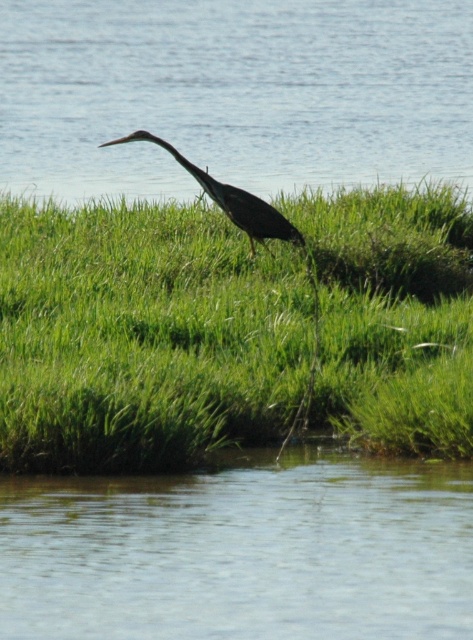
You are a photographer trying to capture the dark gray matte bird at center in your shot. You want to ensure the green grassy at center is visible but not blocking the bird. Based on the scene, can you position yourself so that the bird remains visible without the grass obscuring it?

The green grassy at center is in front of the dark gray matte bird at center, so positioning yourself behind the grassy area would allow the bird to be visible while the grass remains in the foreground without blocking it.

You are a photographer trying to capture the dark gray matte bird at center and the clear blue water at center. Based on their positions, which one appears higher in the image?

The clear blue water at center is taller than the dark gray matte bird at center, so the clear blue water at center appears higher in the image.